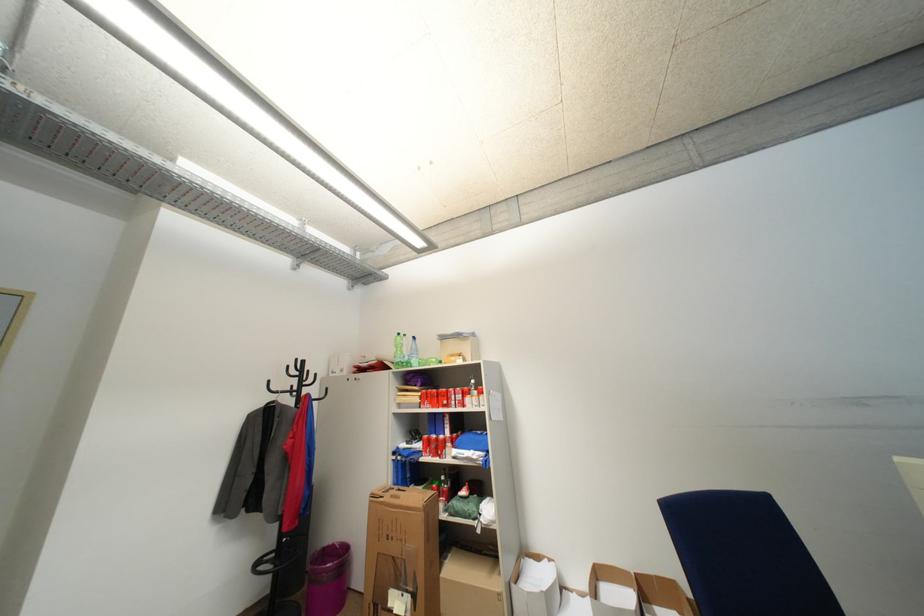
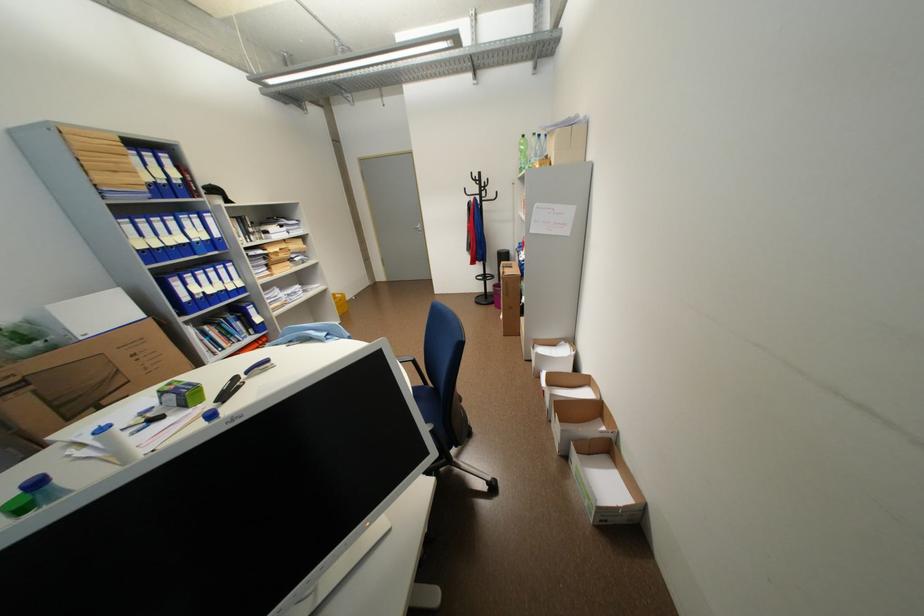
Locate, in the second image, the point that corresponds to the point at 407,334 in the first image.

(531, 137)